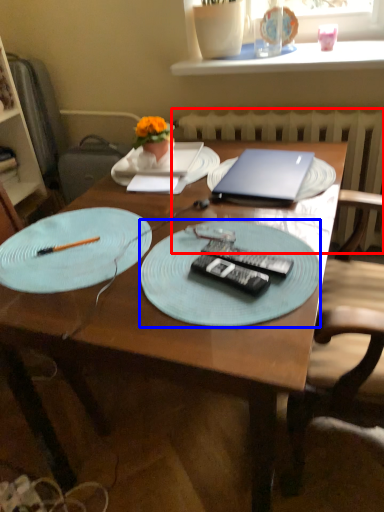
Question: Which point is closer to the camera, radiator (highlighted by a red box) or plate (highlighted by a blue box)?

Choices:
 (A) radiator
 (B) plate

Answer: (B)